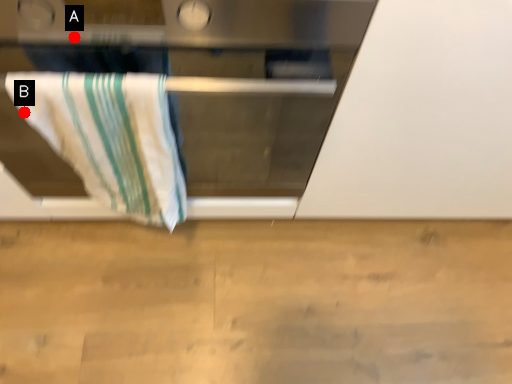
Question: Two points are circled on the image, labeled by A and B beside each circle. Which point is farther to the camera?

Choices:
 (A) A is further
 (B) B is further

Answer: (B)